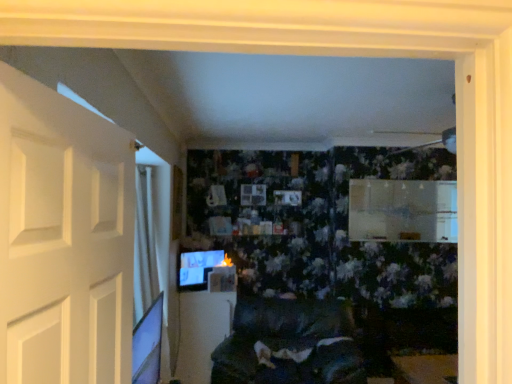
Question: Considering the relative positions of white matte door at left and white glossy table at center in the image provided, is white matte door at left to the right of white glossy table at center from the viewer's perspective?

Choices:
 (A) no
 (B) yes

Answer: (B)

Question: Does white matte door at left have a larger size compared to white glossy table at center?

Choices:
 (A) no
 (B) yes

Answer: (A)

Question: Does white matte door at left have a lesser width compared to white glossy table at center?

Choices:
 (A) yes
 (B) no

Answer: (A)

Question: Is white matte door at left wider than white glossy table at center?

Choices:
 (A) yes
 (B) no

Answer: (B)

Question: Considering the relative sizes of white matte door at left and white glossy table at center in the image provided, is white matte door at left taller than white glossy table at center?

Choices:
 (A) no
 (B) yes

Answer: (A)

Question: Is white matte door at left shorter than white glossy table at center?

Choices:
 (A) no
 (B) yes

Answer: (B)

Question: Is matte black monitor at lower left positioned in front of white glossy table at center?

Choices:
 (A) no
 (B) yes

Answer: (A)

Question: From the image's perspective, is matte black monitor at lower left above white glossy table at center?

Choices:
 (A) yes
 (B) no

Answer: (A)

Question: Considering the relative sizes of matte black monitor at lower left and white glossy table at center in the image provided, is matte black monitor at lower left smaller than white glossy table at center?

Choices:
 (A) yes
 (B) no

Answer: (A)

Question: Can you confirm if matte black monitor at lower left is positioned to the right of white glossy table at center?

Choices:
 (A) no
 (B) yes

Answer: (A)

Question: Can you confirm if matte black monitor at lower left is wider than white glossy table at center?

Choices:
 (A) yes
 (B) no

Answer: (B)

Question: From a real-world perspective, does matte black monitor at lower left stand above white glossy table at center?

Choices:
 (A) no
 (B) yes

Answer: (B)

Question: Is white glossy table at center shorter than matte black monitor at lower left?

Choices:
 (A) no
 (B) yes

Answer: (A)